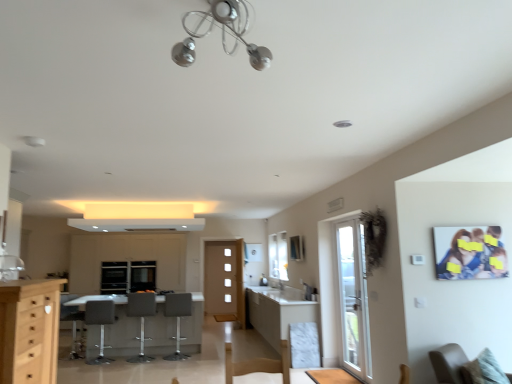
Identify the location of empty space that is ontop of metallic chrome chandelier at upper center. This screenshot has width=512, height=384. (220, 10).